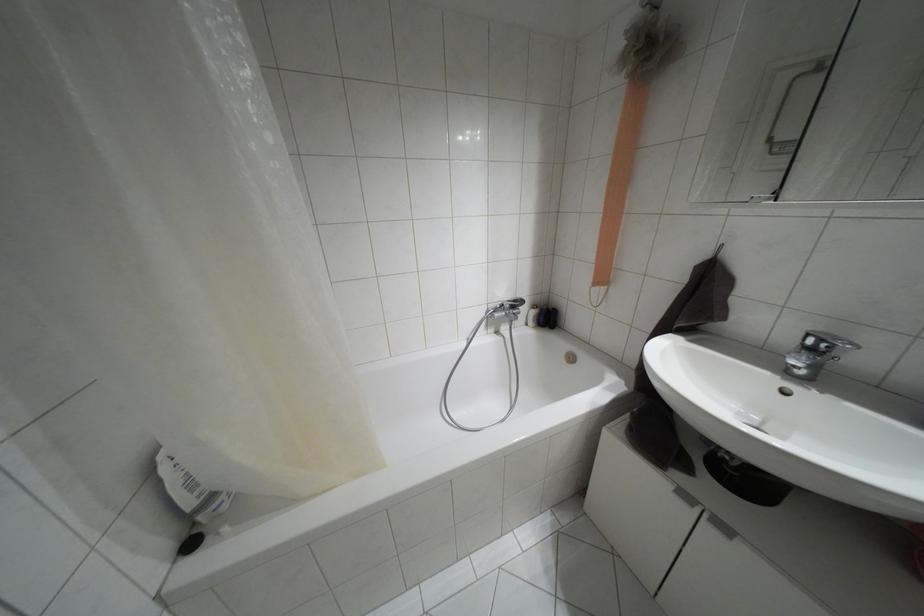
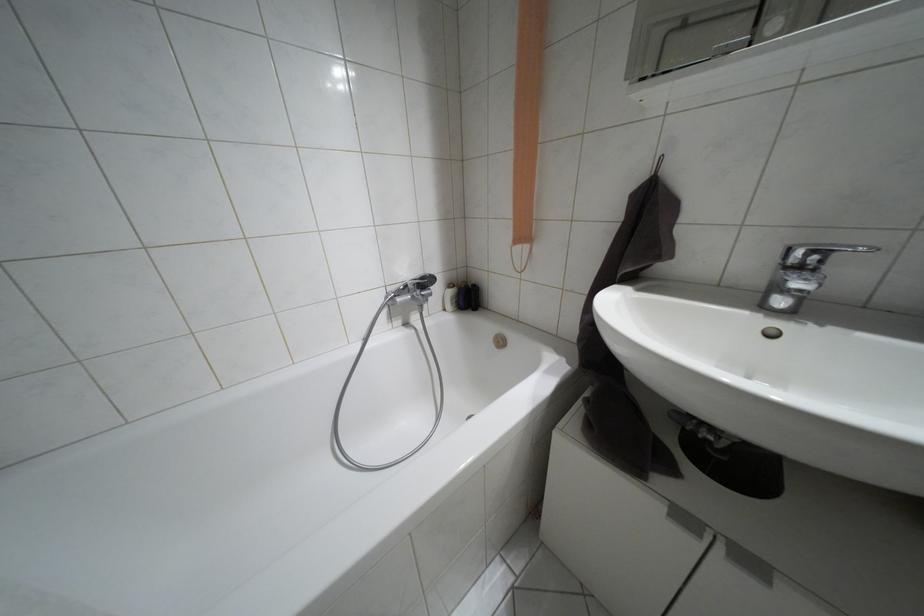
The point at (532, 306) is marked in the first image. Where is the corresponding point in the second image?

(448, 285)